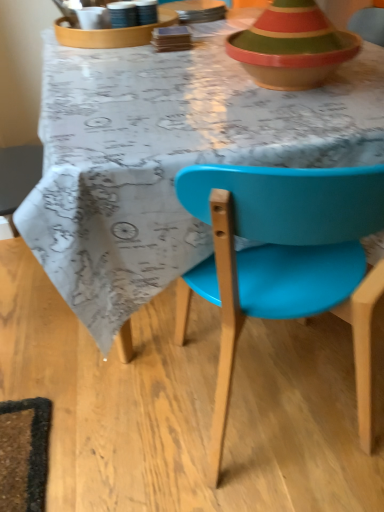
Question: Does matte ceramic cup at upper center, the second tableware from the left, appear on the right side of matte white tray at upper center, the first tableware from the left?

Choices:
 (A) no
 (B) yes

Answer: (B)

Question: Is matte ceramic cup at upper center, the 1th tableware positioned from the right, oriented away from matte white tray at upper center, positioned as the second tableware in right-to-left order?

Choices:
 (A) no
 (B) yes

Answer: (A)

Question: From the image's perspective, is matte ceramic cup at upper center, the 1th tableware positioned from the right, located above matte white tray at upper center, the first tableware from the left?

Choices:
 (A) no
 (B) yes

Answer: (A)

Question: Would you consider matte ceramic cup at upper center, the second tableware from the left, to be distant from matte white tray at upper center, the first tableware from the left?

Choices:
 (A) yes
 (B) no

Answer: (B)

Question: Considering the relative sizes of matte ceramic cup at upper center, the second tableware from the left, and matte white tray at upper center, the first tableware from the left, in the image provided, is matte ceramic cup at upper center, the second tableware from the left, thinner than matte white tray at upper center, the first tableware from the left,?

Choices:
 (A) yes
 (B) no

Answer: (A)

Question: Can you confirm if matte ceramic cup at upper center, the 1th tableware positioned from the right, is shorter than matte white tray at upper center, positioned as the second tableware in right-to-left order?

Choices:
 (A) yes
 (B) no

Answer: (B)

Question: Does matte plastic chair at center have a greater width compared to matte ceramic cup at upper center, the 1th tableware positioned from the right?

Choices:
 (A) yes
 (B) no

Answer: (A)

Question: Are matte plastic chair at center and matte ceramic cup at upper center, the second tableware from the left, far apart?

Choices:
 (A) no
 (B) yes

Answer: (A)

Question: Does matte plastic chair at center appear on the right side of matte ceramic cup at upper center, the second tableware from the left?

Choices:
 (A) yes
 (B) no

Answer: (A)

Question: From the image's perspective, is matte plastic chair at center beneath matte ceramic cup at upper center, the 1th tableware positioned from the right?

Choices:
 (A) yes
 (B) no

Answer: (A)

Question: Is matte plastic chair at center positioned with its back to matte ceramic cup at upper center, the 1th tableware positioned from the right?

Choices:
 (A) yes
 (B) no

Answer: (B)

Question: Does matte plastic chair at center have a larger size compared to matte ceramic cup at upper center, the second tableware from the left?

Choices:
 (A) no
 (B) yes

Answer: (B)

Question: From the image's perspective, is matte plastic chair at center located above matte white tray at upper center, the first tableware from the left?

Choices:
 (A) no
 (B) yes

Answer: (A)